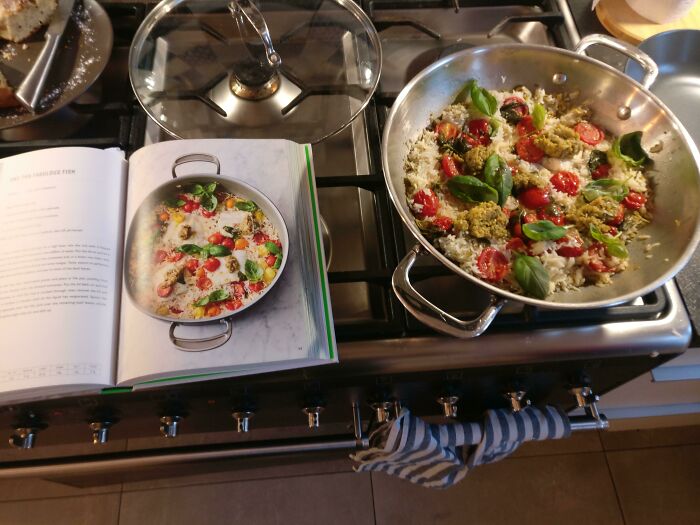
Locate an element on the screen. Image resolution: width=700 pixels, height=525 pixels. oven handle where you can also hang things is located at coordinates (106, 457), (280, 446), (587, 419).